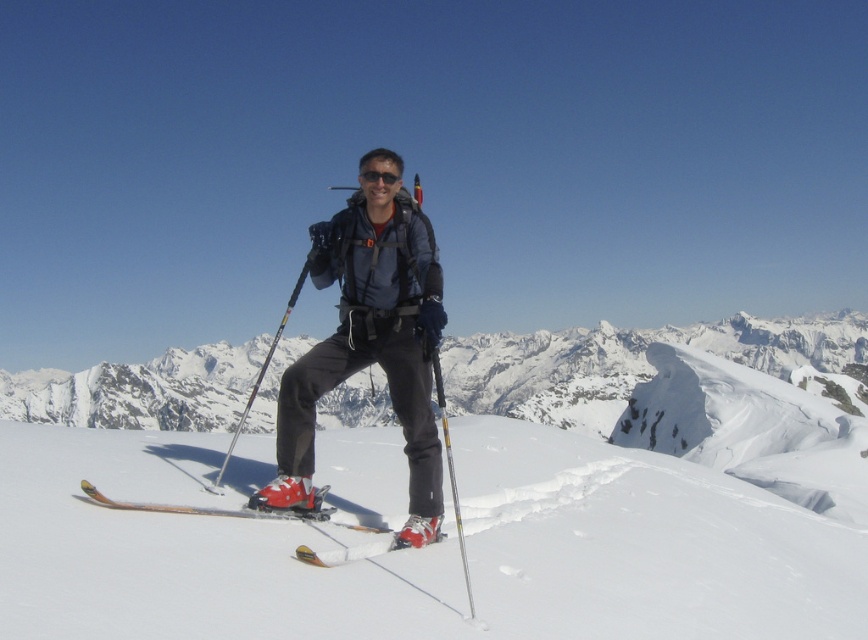
Where is the snowy white mountain at center positioned in the image?

The snowy white mountain at center is positioned at coordinates point (630, 358).

What are the coordinates of the snowy white mountain at center?

The snowy white mountain at center is located at coordinates point (x=630, y=358).

You are planning to take a photo of the white snow ski slope at center and the matte black ski pole at center. Which object should you focus on if you want to capture both in the frame without cropping either? Explain your reasoning.

The white snow ski slope at center occupies less space than the matte black ski pole at center, so you should focus on the matte black ski pole at center to ensure both objects fit in the frame without cropping.